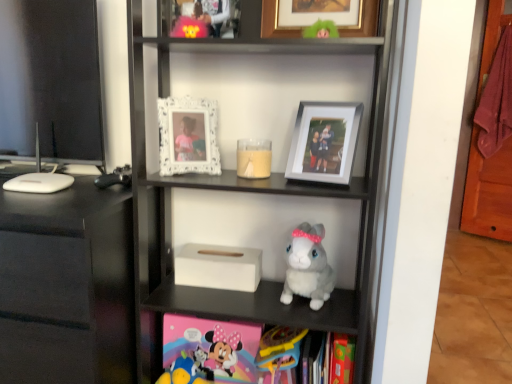
How much space does white ornate frame at upper center, positioned as the third picture frame in right-to-left order, occupy horizontally?

It is 8.38 centimeters.

This screenshot has width=512, height=384. Describe the element at coordinates (66, 285) in the screenshot. I see `black glossy tv stand at left` at that location.

This screenshot has height=384, width=512. Describe the element at coordinates (218, 267) in the screenshot. I see `white matte tissue box at center` at that location.

Measure the distance between point (315, 289) and camera.

Point (315, 289) and camera are 3.91 feet apart from each other.

Where is `soft plush toy at lower center, acting as the 3th toy starting from the right`? soft plush toy at lower center, acting as the 3th toy starting from the right is located at coordinates (186, 372).

Where is `gold-framed picture at upper center, which is the 1th picture frame in top-to-bottom order`? This screenshot has height=384, width=512. gold-framed picture at upper center, which is the 1th picture frame in top-to-bottom order is located at coordinates (320, 17).

Measure the distance between matte burgundy towel at right and camera.

The distance of matte burgundy towel at right from camera is 2.94 meters.

The image size is (512, 384). Find the location of `white ornate frame at upper center, which is the second picture frame in bottom-to-top order`. white ornate frame at upper center, which is the second picture frame in bottom-to-top order is located at coordinates (188, 136).

From the image's perspective, would you say soft plush toy at lower center, acting as the 3th toy starting from the right, is positioned over fluffy gray plush at center, arranged as the first toy when viewed from the right?

No.

Where is `the 2nd toy in front of the soft plush toy at lower center, acting as the 3th toy starting from the right`? the 2nd toy in front of the soft plush toy at lower center, acting as the 3th toy starting from the right is located at coordinates (308, 267).

Considering the relative sizes of soft plush toy at lower center, which appears as the 1th toy when viewed from the left, and fluffy gray plush at center, arranged as the first toy when viewed from the right, in the image provided, is soft plush toy at lower center, which appears as the 1th toy when viewed from the left, bigger than fluffy gray plush at center, arranged as the first toy when viewed from the right,?

Incorrect, soft plush toy at lower center, which appears as the 1th toy when viewed from the left, is not larger than fluffy gray plush at center, arranged as the first toy when viewed from the right.

Is soft plush toy at lower center, acting as the 3th toy starting from the right, looking in the opposite direction of fluffy gray plush at center, the third toy from the left?

No, fluffy gray plush at center, the third toy from the left, is not at the back of soft plush toy at lower center, acting as the 3th toy starting from the right.

From the image's perspective, is silver metallic photo frame at upper center, which is the third picture frame in left-to-right order, located above white ornate frame at upper center, positioned as the third picture frame in right-to-left order?

No, from the image's perspective, silver metallic photo frame at upper center, which is the third picture frame in left-to-right order, is not over white ornate frame at upper center, positioned as the third picture frame in right-to-left order.

Which is closer, (354, 110) or (179, 139)?

Point (354, 110) appears to be closer to the viewer than point (179, 139).

Is silver metallic photo frame at upper center, which is counted as the first picture frame, starting from the bottom, looking in the opposite direction of white ornate frame at upper center, the 1th picture frame when ordered from left to right?

That's not correct — silver metallic photo frame at upper center, which is counted as the first picture frame, starting from the bottom, is not looking away from white ornate frame at upper center, the 1th picture frame when ordered from left to right.

Where is `picture frame below the white ornate frame at upper center, the 1th picture frame when ordered from left to right (from a real-world perspective)`? picture frame below the white ornate frame at upper center, the 1th picture frame when ordered from left to right (from a real-world perspective) is located at coordinates (324, 142).

Relative to white ornate frame at upper center, the 1th picture frame when ordered from left to right, is hardcover book at lower center in front or behind?

hardcover book at lower center is in front of white ornate frame at upper center, the 1th picture frame when ordered from left to right.

How much distance is there between hardcover book at lower center and white ornate frame at upper center, positioned as the third picture frame in right-to-left order?

hardcover book at lower center and white ornate frame at upper center, positioned as the third picture frame in right-to-left order, are 25.51 inches apart.

What's the angular difference between hardcover book at lower center and white ornate frame at upper center, the 2th picture frame viewed from the top,'s facing directions?

The angle between the facing direction of hardcover book at lower center and the facing direction of white ornate frame at upper center, the 2th picture frame viewed from the top, is 29 degrees.

Would you say hardcover book at lower center is to the left or to the right of white ornate frame at upper center, which is the second picture frame in bottom-to-top order, in the picture?

hardcover book at lower center is to the right of white ornate frame at upper center, which is the second picture frame in bottom-to-top order.

Is white glossy computer monitor at left wider than white ornate frame at upper center, which is the second picture frame in bottom-to-top order?

No.

Considering the positions of points (15, 41) and (212, 123), is point (15, 41) closer to camera compared to point (212, 123)?

No, it is not.

Looking at this image, is the depth of white glossy computer monitor at left less than that of white ornate frame at upper center, the 2th picture frame viewed from the top?

That is False.

Is there a large distance between white glossy computer monitor at left and white ornate frame at upper center, the 1th picture frame when ordered from left to right?

No, white glossy computer monitor at left is not far away from white ornate frame at upper center, the 1th picture frame when ordered from left to right.

At what (x,y) coordinates should I click in order to perform the action: click on the 1st toy counting from the right side of the white ornate frame at upper center, which is the second picture frame in bottom-to-top order. Please return your answer as a coordinate pair (x, y). Image resolution: width=512 pixels, height=384 pixels. Looking at the image, I should click on (279, 350).

Who is bigger, white ornate frame at upper center, the 2th picture frame viewed from the top, or plastic yellow toy at lower center, marked as the 2th toy in a left-to-right arrangement?

With larger size is plastic yellow toy at lower center, marked as the 2th toy in a left-to-right arrangement.

Considering the relative sizes of white ornate frame at upper center, which is the second picture frame in bottom-to-top order, and plastic yellow toy at lower center, which ranks as the second toy in right-to-left order, in the image provided, is white ornate frame at upper center, which is the second picture frame in bottom-to-top order, taller than plastic yellow toy at lower center, which ranks as the second toy in right-to-left order,?

No.

This screenshot has width=512, height=384. I want to click on the 1st toy directly beneath the matte burgundy towel at right (from a real-world perspective), so click(x=308, y=267).

Is matte burgundy towel at right further to camera compared to fluffy gray plush at center, the third toy from the left?

Yes, matte burgundy towel at right is further from the camera.

From a real-world perspective, is matte burgundy towel at right positioned above or below fluffy gray plush at center, the third toy from the left?

Clearly, from a real-world perspective, matte burgundy towel at right is above fluffy gray plush at center, the third toy from the left.

Who is shorter, matte burgundy towel at right or fluffy gray plush at center, arranged as the first toy when viewed from the right?

With less height is fluffy gray plush at center, arranged as the first toy when viewed from the right.

From a real-world perspective, who is located higher, matte burgundy towel at right or white matte tissue box at center?

matte burgundy towel at right.

From the image's perspective, is matte burgundy towel at right under white matte tissue box at center?

No, from the image's perspective, matte burgundy towel at right is not below white matte tissue box at center.

Could you tell me if matte burgundy towel at right is facing white matte tissue box at center?

Yes, matte burgundy towel at right faces towards white matte tissue box at center.

At what (x,y) coordinates should I click in order to perform the action: click on toy that is the 2nd object located below the fluffy gray plush at center, the third toy from the left (from the image's perspective). Please return your answer as a coordinate pair (x, y). Looking at the image, I should click on (186, 372).

From the image's perspective, starting from the silver metallic photo frame at upper center, which is counted as the first picture frame, starting from the bottom, which picture frame is the 1st one above? Please provide its 2D coordinates.

[(188, 136)]

Based on their spatial positions, is white glossy computer monitor at left or hardcover book at lower center further from matte burgundy towel at right?

Based on the image, white glossy computer monitor at left appears to be further to matte burgundy towel at right.

When comparing their distances from white matte tissue box at center, does matte burgundy towel at right or gold-framed picture at upper center, which is the 1th picture frame in top-to-bottom order, seem closer?

Based on the image, gold-framed picture at upper center, which is the 1th picture frame in top-to-bottom order, appears to be nearer to white matte tissue box at center.

In the scene shown: Based on their spatial positions, is white matte tissue box at center or plastic yellow toy at lower center, which ranks as the second toy in right-to-left order, closer to translucent glass candle at center?

white matte tissue box at center is positioned closer to the anchor translucent glass candle at center.

Considering their positions, is hardcover book at lower center positioned closer to black glossy tv stand at left than fluffy gray plush at center, the third toy from the left?

Among the two, fluffy gray plush at center, the third toy from the left, is located nearer to black glossy tv stand at left.

Considering their positions, is white glossy computer monitor at left positioned further to translucent glass candle at center than silver metallic photo frame at upper center, positioned as the 3th picture frame in top-to-bottom order?

Among the two, white glossy computer monitor at left is located further to translucent glass candle at center.

Considering their positions, is fluffy gray plush at center, arranged as the first toy when viewed from the right, positioned further to soft plush toy at lower center, which appears as the 1th toy when viewed from the left, than white ornate frame at upper center, the 2th picture frame viewed from the top?

white ornate frame at upper center, the 2th picture frame viewed from the top.

Which object lies nearer to the anchor point fluffy gray plush at center, the third toy from the left, white matte tissue box at center or white matte tissue box at center?

white matte tissue box at center.

From the image, which object appears to be nearer to plastic yellow toy at lower center, which ranks as the second toy in right-to-left order, white matte tissue box at center or silver metallic photo frame at upper center, positioned as the 3th picture frame in top-to-bottom order?

Among the two, white matte tissue box at center is located nearer to plastic yellow toy at lower center, which ranks as the second toy in right-to-left order.

Locate an element on the screen. This screenshot has width=512, height=384. candle holder between gold-framed picture at upper center, which is the second picture frame from left to right, and hardcover book at lower center, in the vertical direction is located at coordinates (254, 158).

Locate an element on the screen. The image size is (512, 384). book situated between white ornate frame at upper center, which is the second picture frame in bottom-to-top order, and matte burgundy towel at right from left to right is located at coordinates (328, 358).

Find the location of a particular element. box between fluffy gray plush at center, arranged as the first toy when viewed from the right, and soft plush toy at lower center, acting as the 3th toy starting from the right, vertically is located at coordinates (218, 267).

Image resolution: width=512 pixels, height=384 pixels. I want to click on computer monitor between black glossy tv stand at left and matte burgundy towel at right, so click(50, 82).